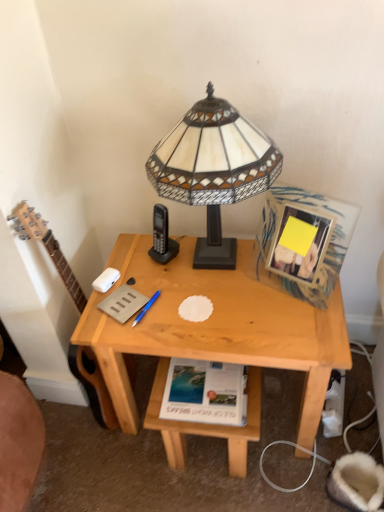
The image size is (384, 512). Find the location of `blank space situated above light wood desk at center (from a real-world perspective)`. blank space situated above light wood desk at center (from a real-world perspective) is located at coordinates (212, 289).